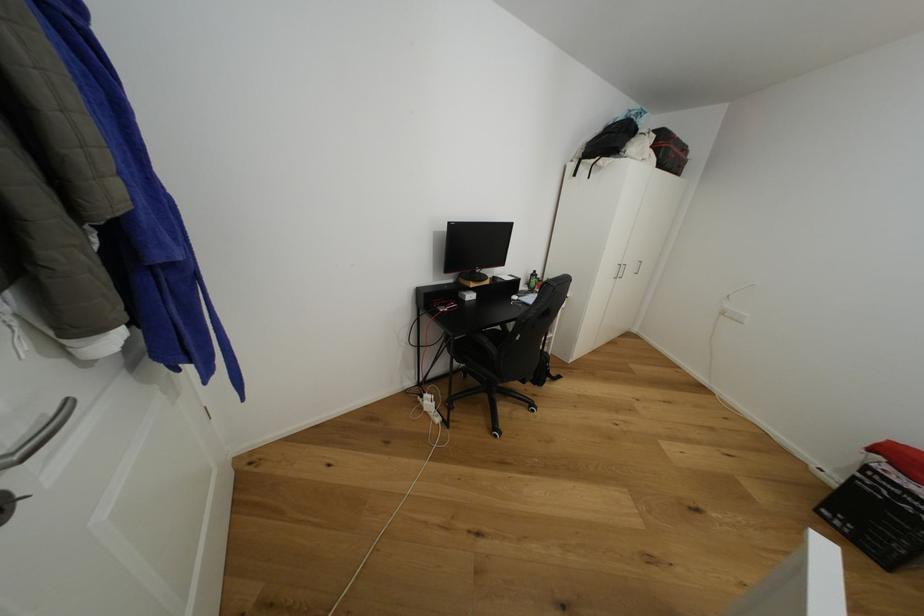
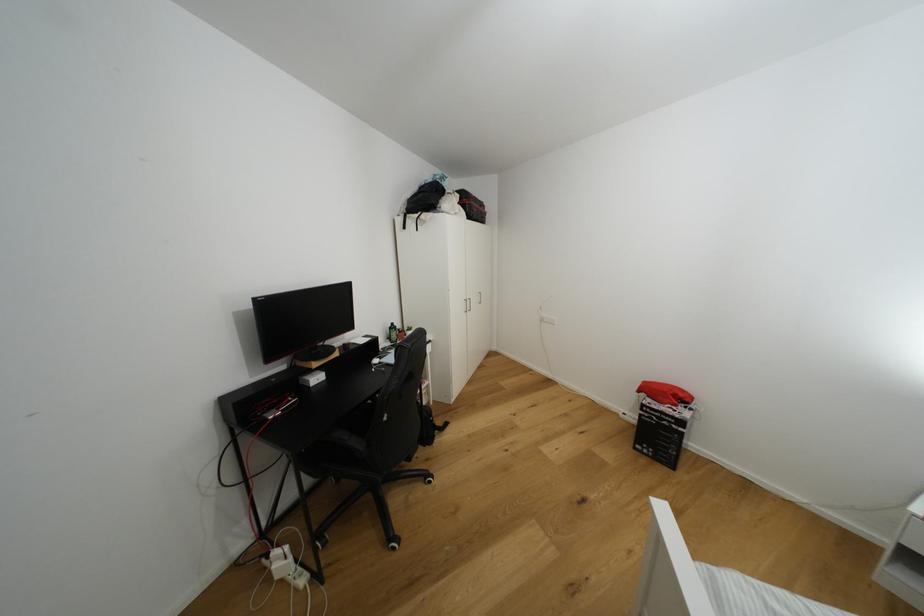
The point at (638, 140) is marked in the first image. Where is the corresponding point in the second image?

(448, 199)